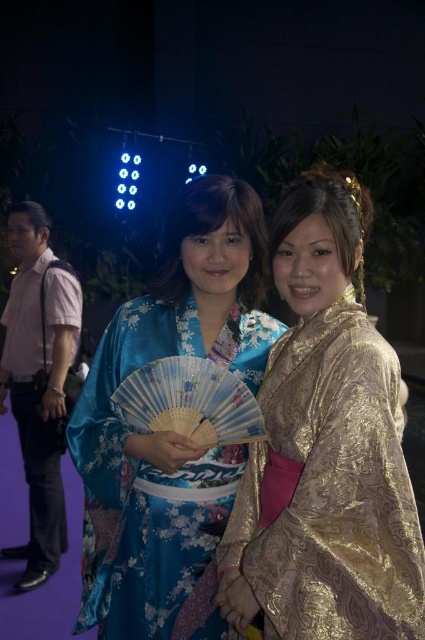
Question: Which is farther from the satin kimono at center?

Choices:
 (A) gold shiny kimono at right
 (B) pink shirt at left

Answer: (B)

Question: Which of the following is the farthest from the observer?

Choices:
 (A) pink shirt at left
 (B) gold shiny kimono at right

Answer: (A)

Question: Is gold shiny kimono at right smaller than pink shirt at left?

Choices:
 (A) no
 (B) yes

Answer: (B)

Question: Does gold shiny kimono at right appear under satin kimono at center?

Choices:
 (A) yes
 (B) no

Answer: (B)

Question: Does gold shiny kimono at right appear on the right side of satin kimono at center?

Choices:
 (A) no
 (B) yes

Answer: (B)

Question: Estimate the real-world distances between objects in this image. Which object is farther from the satin kimono at center?

Choices:
 (A) pink shirt at left
 (B) gold shiny kimono at right

Answer: (A)